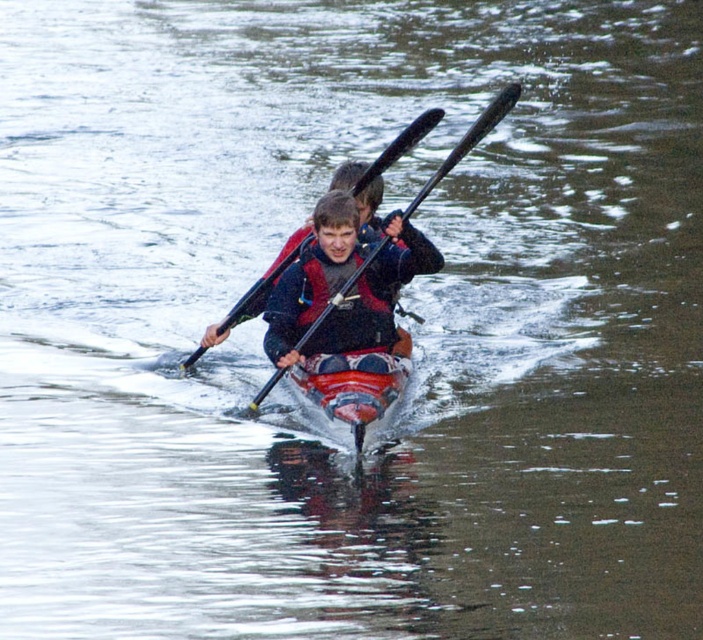
Does matte red life jacket at center have a lesser width compared to black plastic paddle at center?

Yes, matte red life jacket at center is thinner than black plastic paddle at center.

Between matte red life jacket at center and black plastic paddle at center, which one has less height?

matte red life jacket at center

Is point (323, 344) more distant than point (245, 307)?

No, it is not.

Find the location of a particular element. Image resolution: width=703 pixels, height=640 pixels. matte red life jacket at center is located at coordinates (361, 308).

Is matte red life jacket at center to the right of red plastic canoe at center from the viewer's perspective?

Correct, you'll find matte red life jacket at center to the right of red plastic canoe at center.

This screenshot has height=640, width=703. Find the location of `matte red life jacket at center`. matte red life jacket at center is located at coordinates (361, 308).

Can you confirm if red plastic canoe at center is positioned above black plastic paddle at center?

Actually, red plastic canoe at center is below black plastic paddle at center.

Does red plastic canoe at center have a lesser width compared to black plastic paddle at center?

Yes, red plastic canoe at center is thinner than black plastic paddle at center.

Is point (368, 413) positioned before point (309, 237)?

Yes, it is.

Locate an element on the screen. This screenshot has height=640, width=703. red plastic canoe at center is located at coordinates (354, 381).